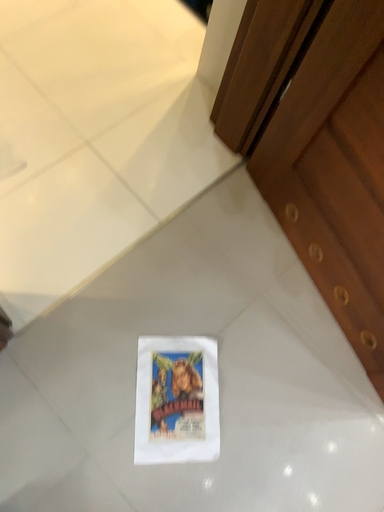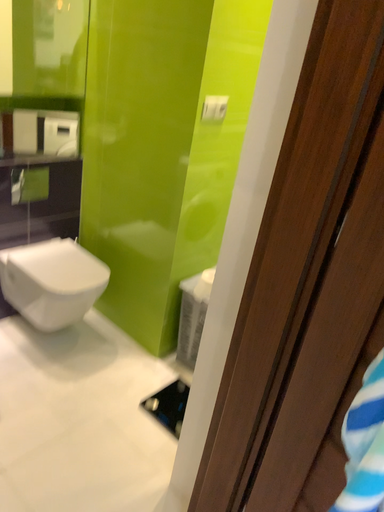
Question: Which way did the camera rotate in the video?

Choices:
 (A) rotated upward
 (B) rotated downward

Answer: (A)